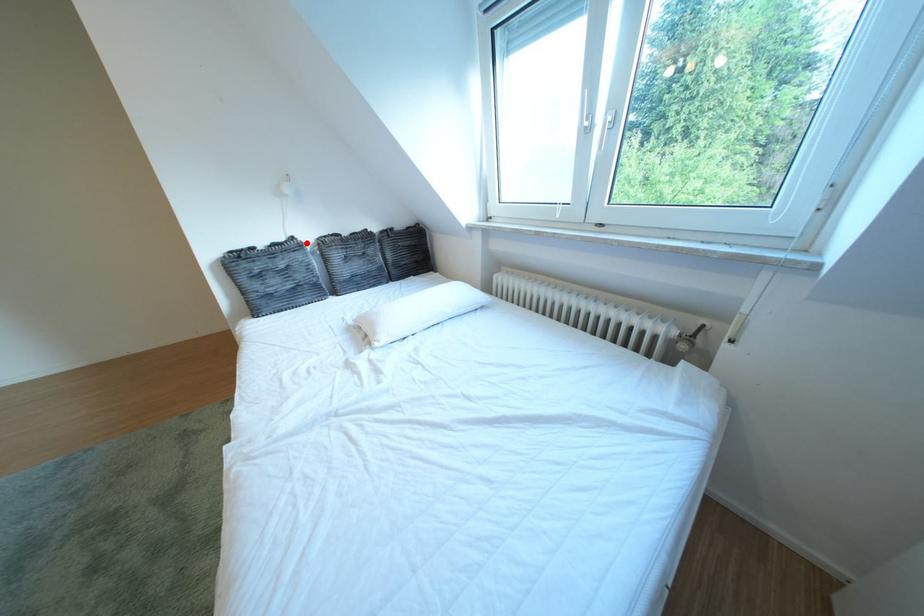
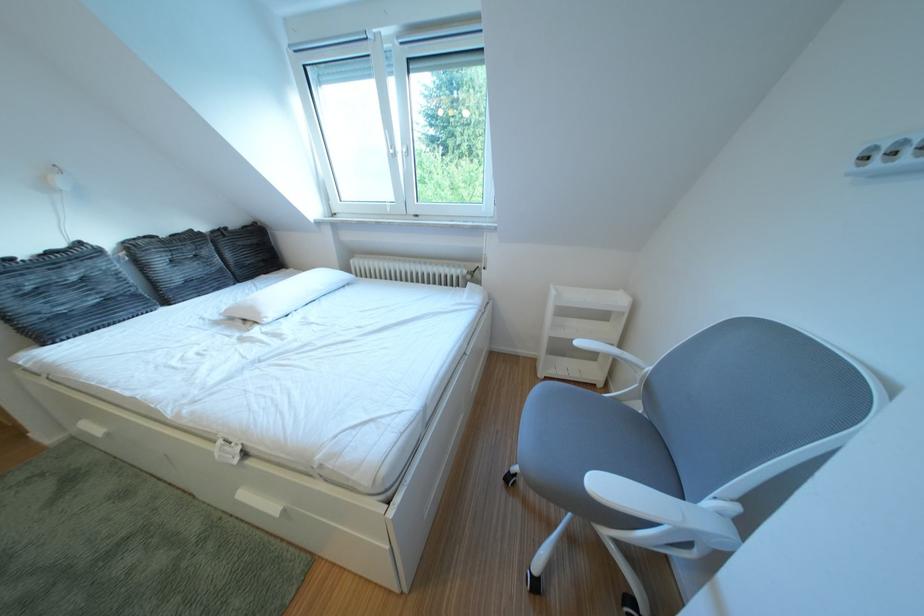
The point at the highlighted location is marked in the first image. Where is the corresponding point in the second image?

(93, 249)